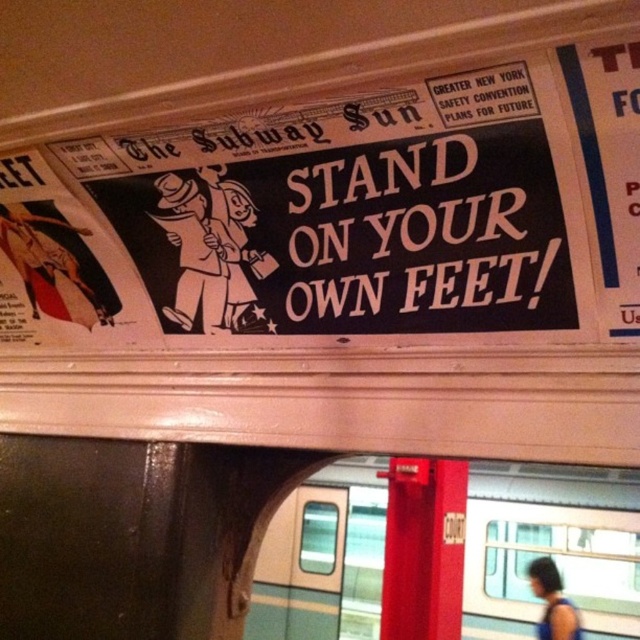
Question: Can you confirm if whitematerial/texture sign at center is positioned to the right of teal glossy train at center?

Choices:
 (A) yes
 (B) no

Answer: (B)

Question: Which of the following is the farthest from the observer?

Choices:
 (A) (548, 572)
 (B) (522, 612)
 (C) (616, 294)
 (D) (515, 339)

Answer: (A)

Question: Which point is farther to the camera?

Choices:
 (A) (330, 609)
 (B) (600, 170)
 (C) (540, 582)

Answer: (A)

Question: Which of the following is the farthest from the observer?

Choices:
 (A) (627, 140)
 (B) (324, 321)
 (C) (534, 563)

Answer: (C)

Question: Is teal glossy train at center below dark blue fabric at lower right?

Choices:
 (A) yes
 (B) no

Answer: (B)

Question: Can you confirm if teal glossy train at center is positioned to the left of white paper poster at upper right?

Choices:
 (A) yes
 (B) no

Answer: (B)